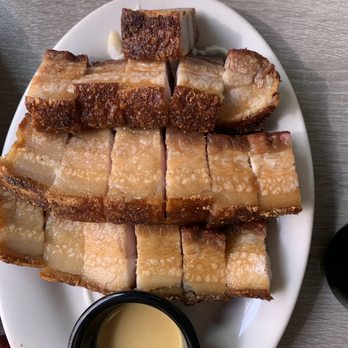
Where is `plate`? This screenshot has width=348, height=348. plate is located at coordinates (252, 319).